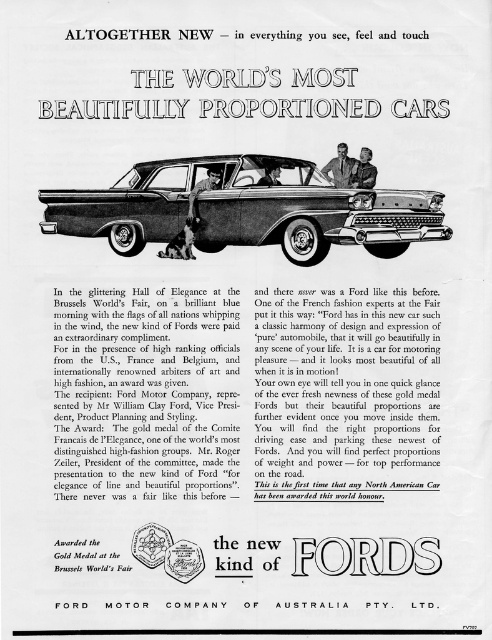
Does shiny dark brown car at center have a greater height compared to matte black suit at center?

Yes, shiny dark brown car at center is taller than matte black suit at center.

Is point (396, 200) more distant than point (268, 172)?

Yes, it is.

Where is `shiny dark brown car at center`? shiny dark brown car at center is located at coordinates (246, 211).

From the picture: Does shiny dark brown car at center come behind matte black car door handle at center?

No, it is not.

Is shiny dark brown car at center thinner than matte black car door handle at center?

No, shiny dark brown car at center is not thinner than matte black car door handle at center.

The width and height of the screenshot is (492, 640). Identify the location of shiny dark brown car at center. (246, 211).

Can you confirm if shiny dark brown car at center is positioned below dark blue suit at center?

Yes.

I want to click on shiny dark brown car at center, so click(246, 211).

Image resolution: width=492 pixels, height=640 pixels. Describe the element at coordinates (246, 211) in the screenshot. I see `shiny dark brown car at center` at that location.

At what (x,y) coordinates should I click in order to perform the action: click on shiny dark brown car at center. Please return your answer as a coordinate pair (x, y). Looking at the image, I should click on (246, 211).